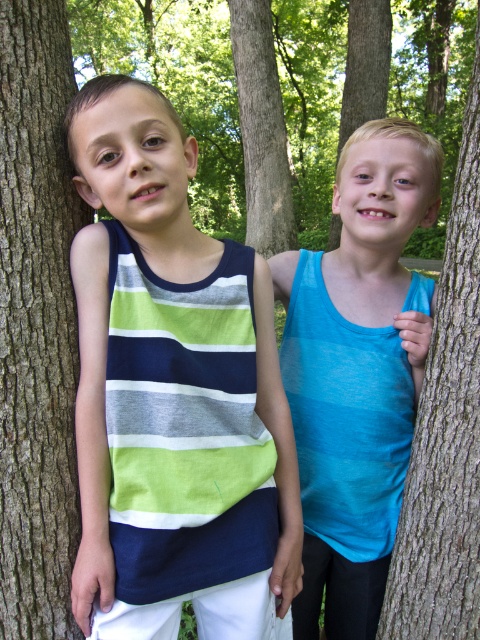
Question: Which point appears closest to the camera in this image?

Choices:
 (A) (424, 605)
 (B) (2, 611)
 (C) (111, 588)
 (D) (299, 348)

Answer: (C)

Question: Considering the real-world distances, which object is farthest from the blue smooth tank top at right?

Choices:
 (A) striped cotton tank top at left
 (B) brown rough tree trunk at right

Answer: (A)

Question: Can you confirm if striped cotton tank top at left is wider than brown rough tree trunk at right?

Choices:
 (A) yes
 (B) no

Answer: (A)

Question: Can you confirm if blue smooth tank top at right is positioned above brown rough tree trunk at right?

Choices:
 (A) yes
 (B) no

Answer: (B)

Question: Considering the relative positions of striped cotton tank top at left and brown rough tree trunk at right in the image provided, where is striped cotton tank top at left located with respect to brown rough tree trunk at right?

Choices:
 (A) above
 (B) below

Answer: (B)

Question: Which object appears farthest from the camera in this image?

Choices:
 (A) brown rough tree trunk at left
 (B) blue smooth tank top at right
 (C) striped cotton tank top at left

Answer: (B)